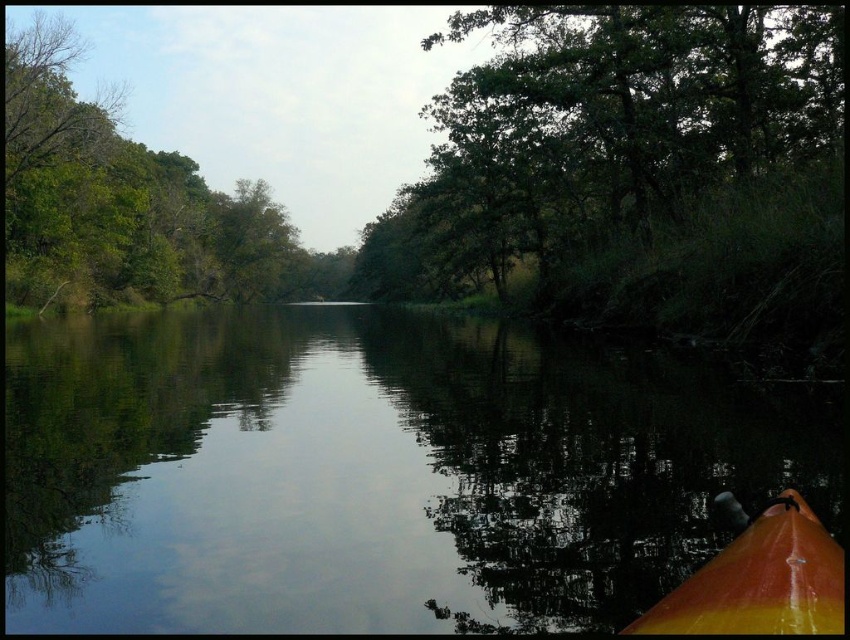
Is smooth water at center smaller than green leafy tree at upper center?

Correct, smooth water at center occupies less space than green leafy tree at upper center.

Does smooth water at center have a lesser height compared to green leafy tree at upper center?

Yes, smooth water at center is shorter than green leafy tree at upper center.

Who is more distant from viewer, (60, 342) or (688, 193)?

Point (60, 342)

Where is `smooth water at center`? This screenshot has width=850, height=640. smooth water at center is located at coordinates (363, 474).

Between green leafy tree at upper center and orange glossy canoe at lower right, which one is positioned higher?

green leafy tree at upper center is higher up.

Can you confirm if green leafy tree at upper center is wider than orange glossy canoe at lower right?

Yes.

Is point (525, 236) closer to camera compared to point (820, 547)?

No, (525, 236) is behind (820, 547).

This screenshot has width=850, height=640. What are the coordinates of `green leafy tree at upper center` in the screenshot? It's located at 599,132.

Describe the element at coordinates (363, 474) in the screenshot. I see `smooth water at center` at that location.

Can you confirm if smooth water at center is positioned below green leafy trees at upper left?

Correct, smooth water at center is located below green leafy trees at upper left.

Who is more distant from viewer, (689, 488) or (173, 282)?

Point (173, 282)

This screenshot has height=640, width=850. Find the location of `smooth water at center`. smooth water at center is located at coordinates (363, 474).